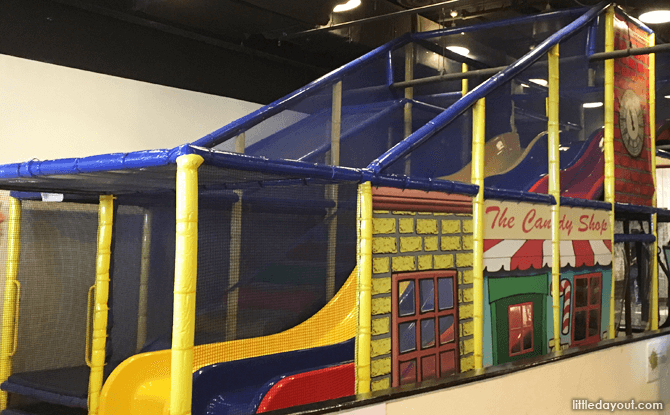
Locate an element on the screen. clock is located at coordinates (634, 122).